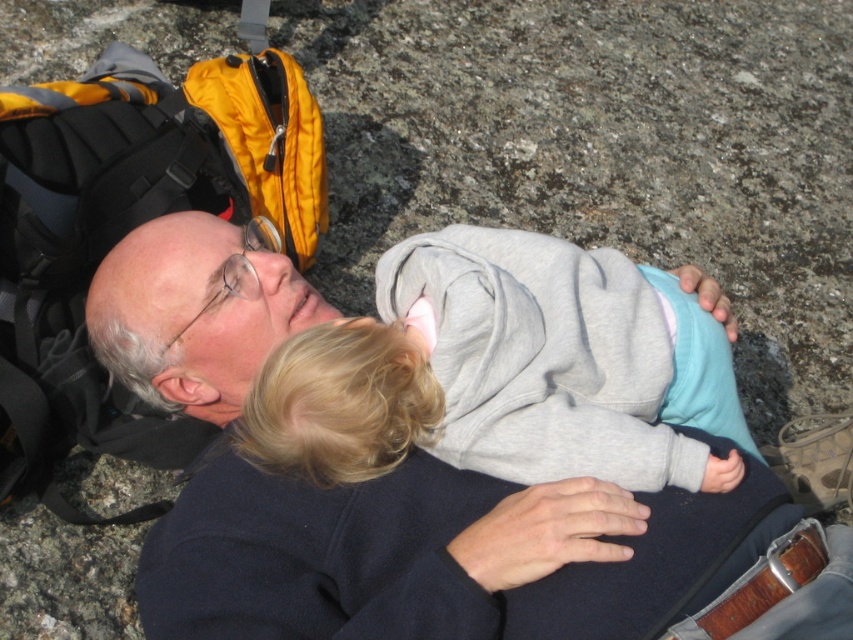
In the scene shown: You are a photographer trying to capture a closeup shot of both the dark blue sweater at center and the gray fleece jacket at center in the scene described. Your camera has a maximum focus range of 4 inches. Can you fit both items within the camera frame without moving the camera?

The dark blue sweater at center and gray fleece jacket at center are 4.49 inches apart from each other. Since the distance between them exceeds the camera maximum focus range of 4 inches, you cannot fit both items within the camera frame without moving the camera.

You are a hiker who needs to decide which clothing item to take first from the rocky area. Since both the dark blue sweater at center and the gray fleece jacket at center are visible, which one is taller and thus easier to reach?

The dark blue sweater at center is taller than the gray fleece jacket at center, so it is easier to reach.